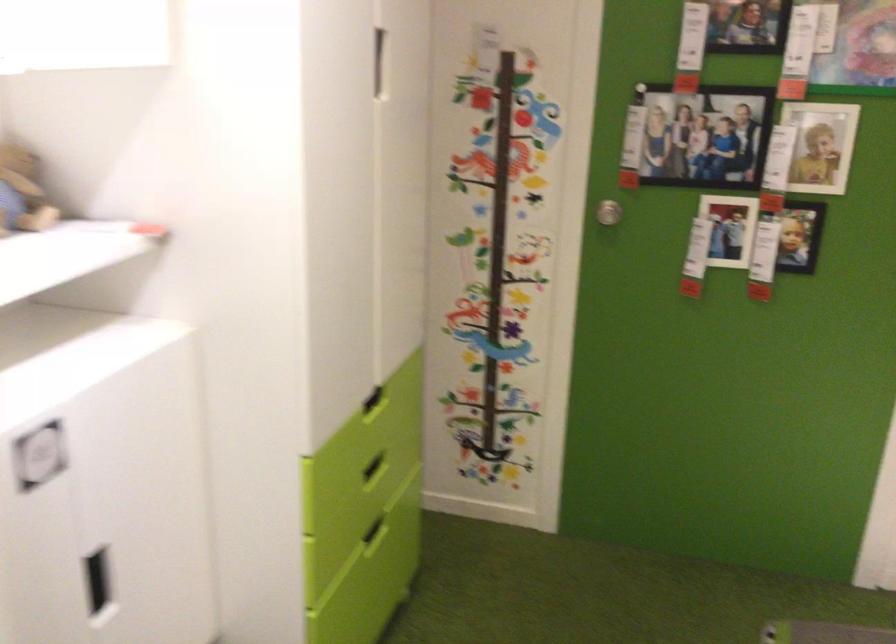
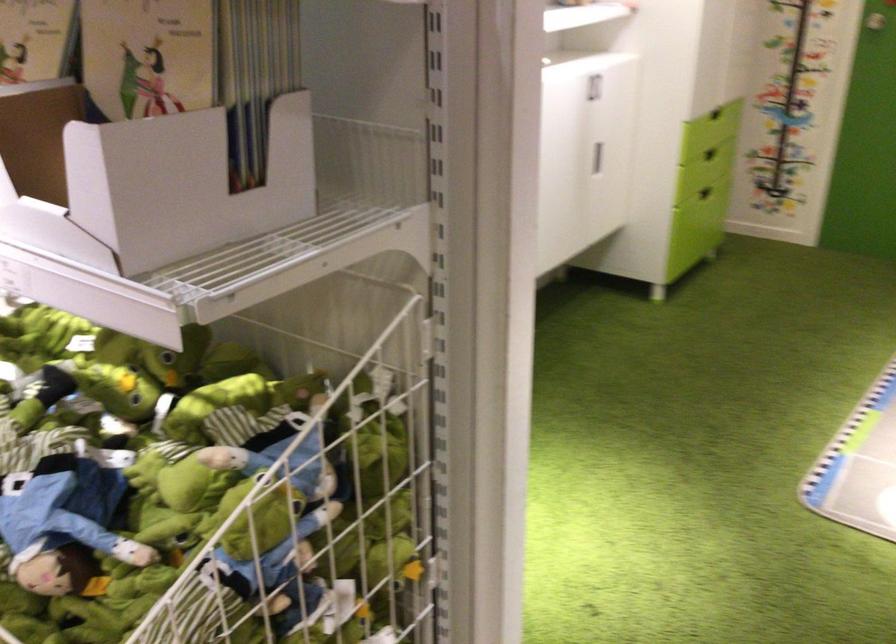
Question: I am providing you with two images of the same scene from different viewpoints. Please identify which objects are invisible in image2.

Choices:
 (A) green drawer handle
 (B) black pen holder
 (C) stuffed frog toy
 (D) white cabinet handle

Answer: (D)